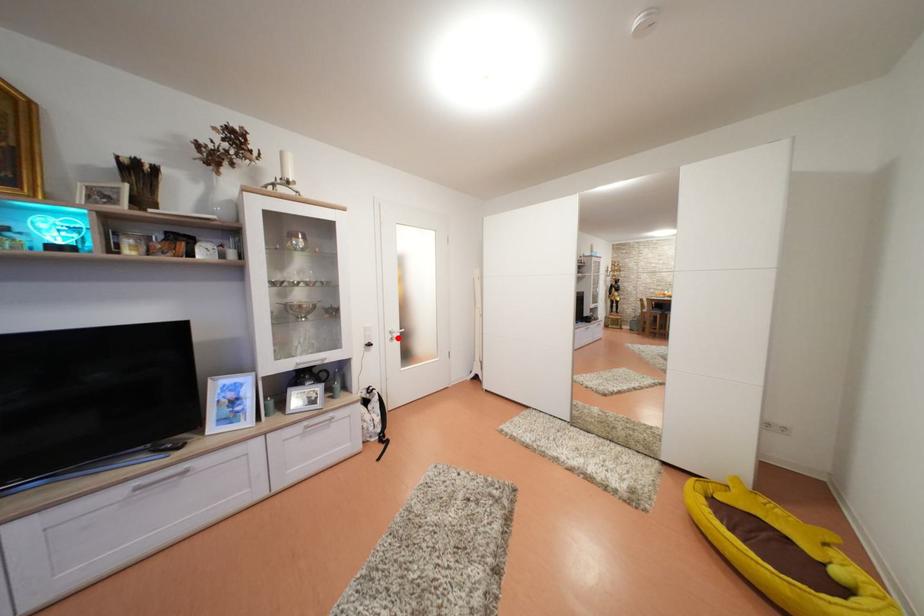
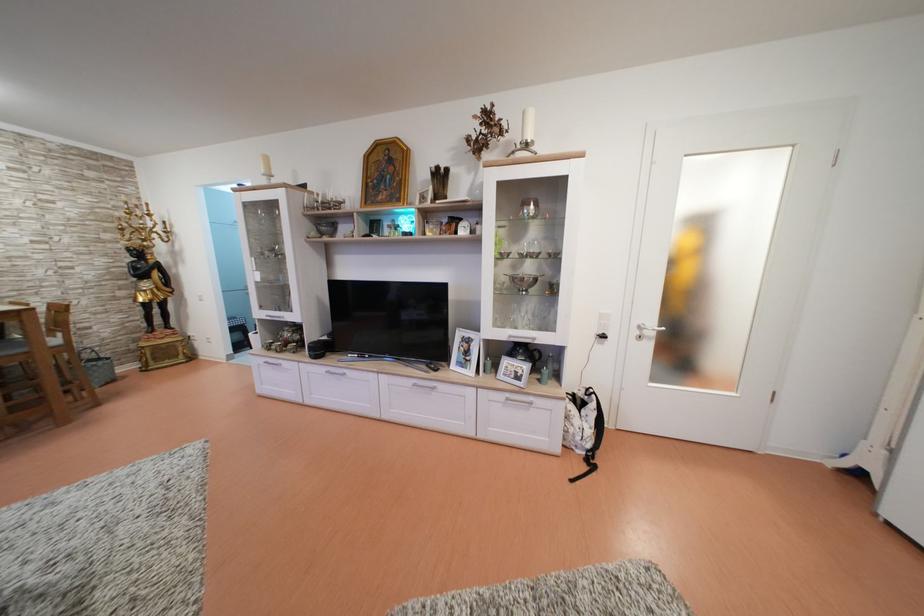
Find the pixel in the second image that matches the highlighted location in the first image.

(647, 333)